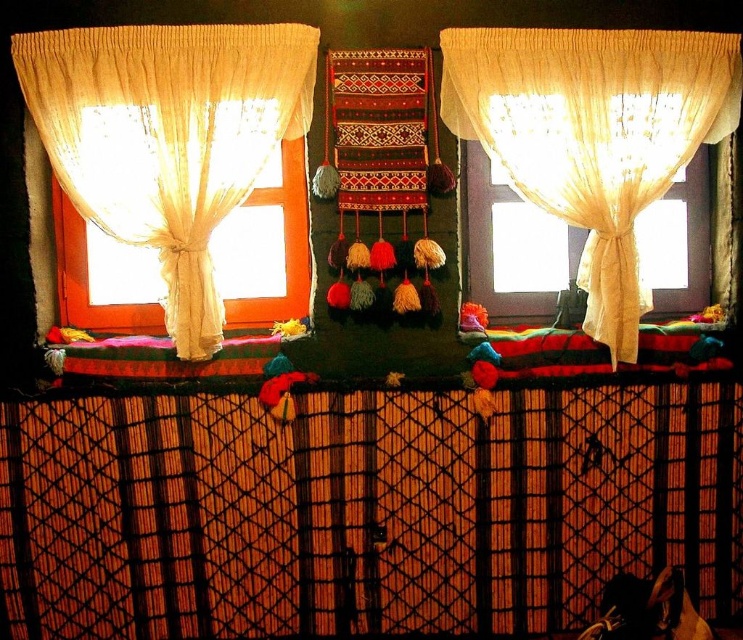
Can you confirm if translucent beige fabric at left is shorter than translucent fabric at right?

No.

Who is more distant from viewer, (311, 96) or (684, 305)?

The point (684, 305) is more distant.

Which is behind, point (94, 214) or point (510, 300)?

The point (510, 300) is more distant.

You are a GUI agent. You are given a task and a screenshot of the screen. Output one action in this format:
    pyautogui.click(x=<x>, y=<y>)
    Task: Click on the translucent beige fabric at left
    This screenshot has height=640, width=743.
    Given the screenshot: What is the action you would take?
    pyautogui.click(x=166, y=138)

Is point (113, 124) farther from viewer compared to point (635, 81)?

No, it is in front of (635, 81).

Which is in front, point (218, 156) or point (557, 172)?

Point (218, 156) is in front.

In order to click on translucent beige fabric at left in this screenshot , I will do `click(166, 138)`.

Is translucent white curtain at upper center taller than translucent fabric at right?

Yes.

Consider the image. Is translucent white curtain at upper center thinner than translucent fabric at right?

No.

Does point (478, 32) come farther from viewer compared to point (489, 294)?

No, it is not.

The width and height of the screenshot is (743, 640). Identify the location of translucent white curtain at upper center. (593, 134).